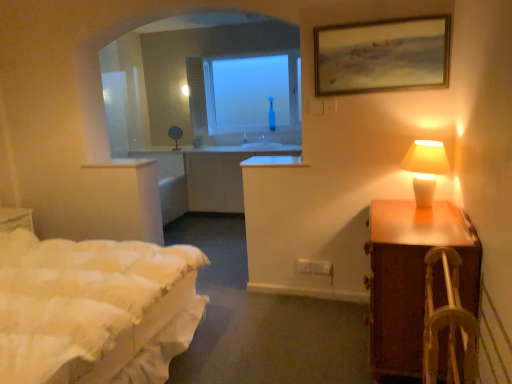
You are a GUI agent. You are given a task and a screenshot of the screen. Output one action in this format:
    pyautogui.click(x=<x>, y=<y>)
    Task: Click on the wooden woven armchair at right
    This screenshot has height=384, width=512.
    Given the screenshot: What is the action you would take?
    coord(448,322)

At what (x,y) coordinates should I click in order to perform the action: click on wooden framed painting at upper right. Please return your answer as a coordinate pair (x, y). The height and width of the screenshot is (384, 512). Looking at the image, I should click on (382, 56).

Is transparent glass window at center turned away from wooden woven armchair at right?

No.

Is transparent glass window at center to the left or to the right of wooden woven armchair at right in the image?

transparent glass window at center is positioned on wooden woven armchair at right's left side.

How distant is transparent glass window at center from wooden woven armchair at right?

transparent glass window at center and wooden woven armchair at right are 16.66 feet apart from each other.

Can you confirm if transparent glass window at center is wider than wooden woven armchair at right?

No, transparent glass window at center is not wider than wooden woven armchair at right.

From a real-world perspective, is wooden framed painting at upper right beneath white quilted bed at left?

No.

Is point (329, 47) positioned in front of point (134, 278)?

No.

This screenshot has width=512, height=384. I want to click on picture frame on the right of white quilted bed at left, so click(x=382, y=56).

Looking at this image, looking at the image, does wooden framed painting at upper right seem bigger or smaller compared to white quilted bed at left?

Clearly, wooden framed painting at upper right is smaller in size than white quilted bed at left.

Is point (432, 365) positioned after point (421, 162)?

No, (432, 365) is in front of (421, 162).

Could you tell me if wooden woven armchair at right is facing white ceramic lamp at right?

No, wooden woven armchair at right is not turned towards white ceramic lamp at right.

In terms of height, does wooden woven armchair at right look taller or shorter compared to white ceramic lamp at right?

Clearly, wooden woven armchair at right is taller compared to white ceramic lamp at right.

Based on their sizes in the image, would you say white ceramic lamp at right is bigger or smaller than wooden framed painting at upper right?

Considering their sizes, white ceramic lamp at right takes up more space than wooden framed painting at upper right.

How far apart are white ceramic lamp at right and wooden framed painting at upper right?

They are 23.94 inches apart.

Where is `table lamp below the wooden framed painting at upper right (from a real-world perspective)`? The width and height of the screenshot is (512, 384). table lamp below the wooden framed painting at upper right (from a real-world perspective) is located at coordinates (426, 169).

From the image's perspective, which object appears higher, white ceramic lamp at right or wooden framed painting at upper right?

wooden framed painting at upper right appears higher in the image.

Is point (326, 29) farther from viewer compared to point (454, 290)?

Yes, it is behind point (454, 290).

Is wooden framed painting at upper right to the left or to the right of wooden woven armchair at right in the image?

From the image, it's evident that wooden framed painting at upper right is to the right of wooden woven armchair at right.

Is wooden framed painting at upper right looking in the opposite direction of wooden woven armchair at right?

No, wooden framed painting at upper right's orientation is not away from wooden woven armchair at right.

Is wooden framed painting at upper right positioned in front of wooden woven armchair at right?

No, it is behind wooden woven armchair at right.

Is wooden framed painting at upper right wider than transparent glass window at center?

Incorrect, the width of wooden framed painting at upper right does not surpass that of transparent glass window at center.

Considering the positions of objects wooden framed painting at upper right and transparent glass window at center in the image provided, who is more to the left, wooden framed painting at upper right or transparent glass window at center?

transparent glass window at center is more to the left.

Looking at this image, from the image's perspective, which object appears higher, wooden framed painting at upper right or transparent glass window at center?

transparent glass window at center appears higher in the image.

From the picture: From a real-world perspective, which object stands above the other?

white ceramic lamp at right.

Considering the positions of objects white ceramic lamp at right and white quilted bed at left in the image provided, who is more to the right, white ceramic lamp at right or white quilted bed at left?

Positioned to the right is white ceramic lamp at right.

Is point (434, 144) behind point (113, 271)?

Yes, it is behind point (113, 271).

Where is `window behind the wooden woven armchair at right`? The height and width of the screenshot is (384, 512). window behind the wooden woven armchair at right is located at coordinates (246, 98).

Where is `picture frame positioned vertically above the white quilted bed at left (from a real-world perspective)`? picture frame positioned vertically above the white quilted bed at left (from a real-world perspective) is located at coordinates (382, 56).

When comparing their distances from brown wooden nightstand at right, does wooden woven armchair at right or white ceramic lamp at right seem further?

Based on the image, white ceramic lamp at right appears to be further to brown wooden nightstand at right.

When comparing their distances from white quilted bed at left, does transparent glass window at center or wooden framed painting at upper right seem closer?

Based on the image, wooden framed painting at upper right appears to be nearer to white quilted bed at left.

Looking at the image, which one is located closer to brown wooden nightstand at right, white quilted bed at left or transparent glass window at center?

white quilted bed at left lies closer to brown wooden nightstand at right than the other object.

Considering their positions, is white quilted bed at left positioned further to wooden framed painting at upper right than wooden woven armchair at right?

white quilted bed at left lies further to wooden framed painting at upper right than the other object.

When comparing their distances from brown wooden nightstand at right, does wooden woven armchair at right or transparent glass window at center seem further?

transparent glass window at center lies further to brown wooden nightstand at right than the other object.

Consider the image. Looking at the image, which one is located closer to wooden woven armchair at right, wooden framed painting at upper right or brown wooden nightstand at right?

Based on the image, brown wooden nightstand at right appears to be nearer to wooden woven armchair at right.

Consider the image. Looking at the image, which one is located further to wooden framed painting at upper right, white quilted bed at left or brown wooden nightstand at right?

white quilted bed at left lies further to wooden framed painting at upper right than the other object.

Which object lies further to the anchor point white quilted bed at left, wooden framed painting at upper right or brown wooden nightstand at right?

Based on the image, wooden framed painting at upper right appears to be further to white quilted bed at left.

Find the location of `picture frame between brown wooden nightstand at right and transparent glass window at center from front to back`. picture frame between brown wooden nightstand at right and transparent glass window at center from front to back is located at coordinates (382, 56).

Locate an element on the screen. The width and height of the screenshot is (512, 384). nightstand between wooden framed painting at upper right and wooden woven armchair at right in the vertical direction is located at coordinates (413, 276).

The height and width of the screenshot is (384, 512). Find the location of `nightstand between white quilted bed at left and transparent glass window at center from front to back`. nightstand between white quilted bed at left and transparent glass window at center from front to back is located at coordinates (413, 276).

Locate an element on the screen. The width and height of the screenshot is (512, 384). picture frame located between white quilted bed at left and transparent glass window at center in the depth direction is located at coordinates (382, 56).